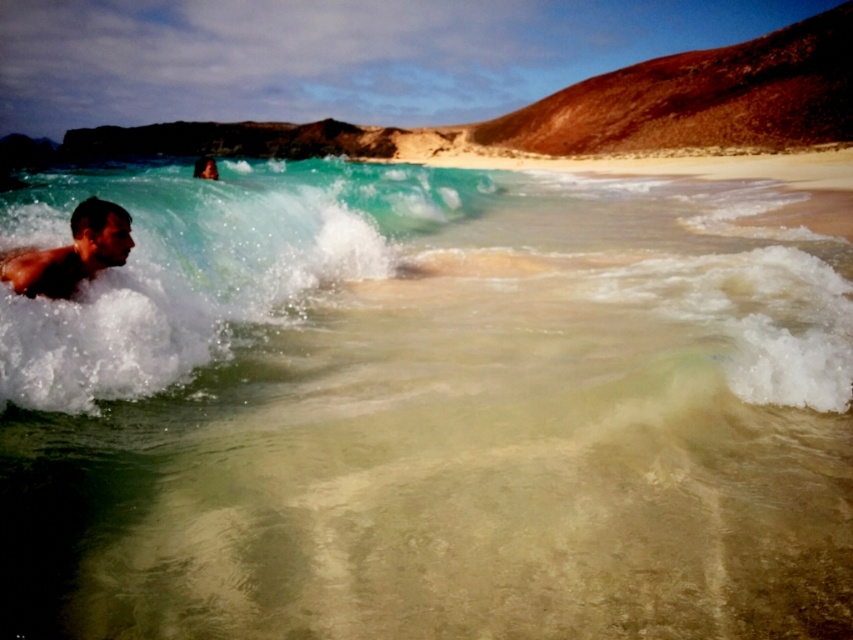
In the scene shown: You are a photographer standing on the beach and want to capture a photo of the translucent white water at left and the smooth skin man at left. Based on their relative heights, which object should you focus on first to ensure it appears larger in the photo?

The translucent white water at left is much taller than the smooth skin man at left, so you should focus on the translucent white water at left first to ensure it appears larger in the photo.

You are a photographer trying to capture a shot of the translucent white water at left and the smooth skin surfer at upper left. Which object should you focus on first if you want to photograph the larger one?

The translucent white water at left is larger than the smooth skin surfer at upper left, so you should focus on the translucent white water at left first.